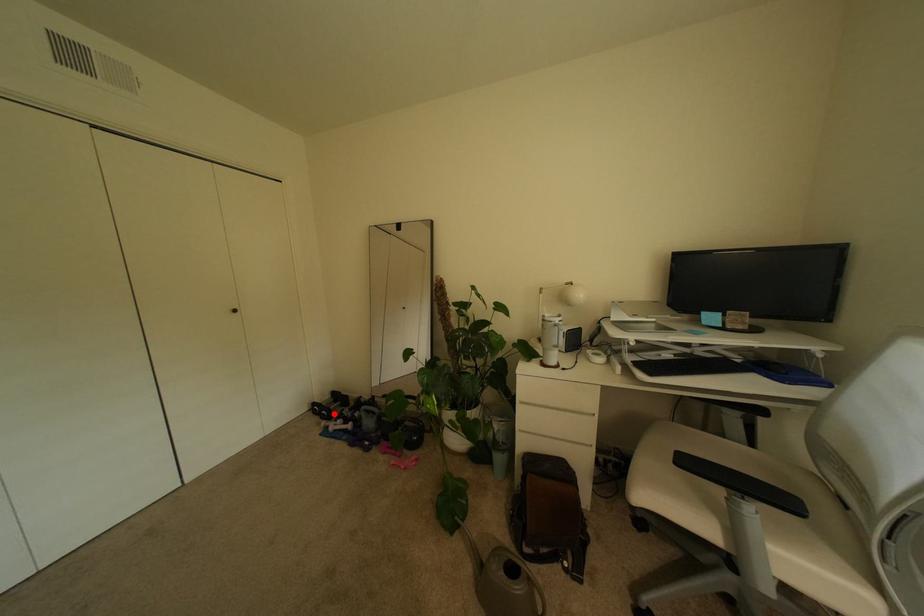
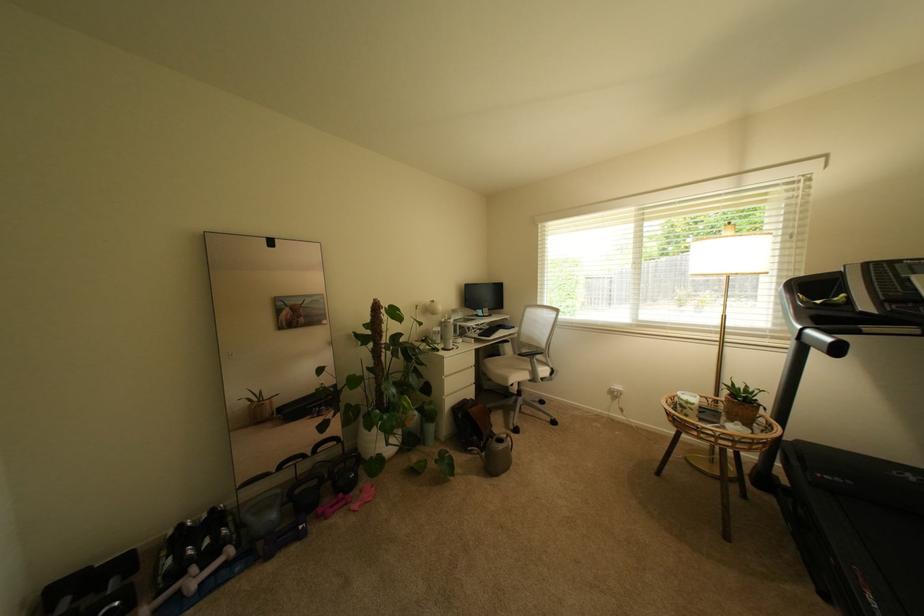
Find the pixel in the second image that matches the highlighted location in the first image.

(126, 604)